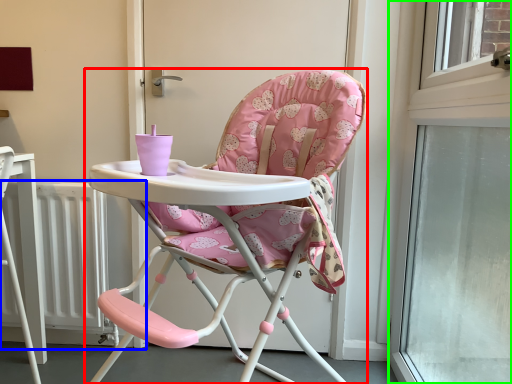
Question: Estimate the real-world distances between objects in this image. Which object is closer to chair (highlighted by a red box), radiator (highlighted by a blue box) or window (highlighted by a green box)?

Choices:
 (A) radiator
 (B) window

Answer: (B)